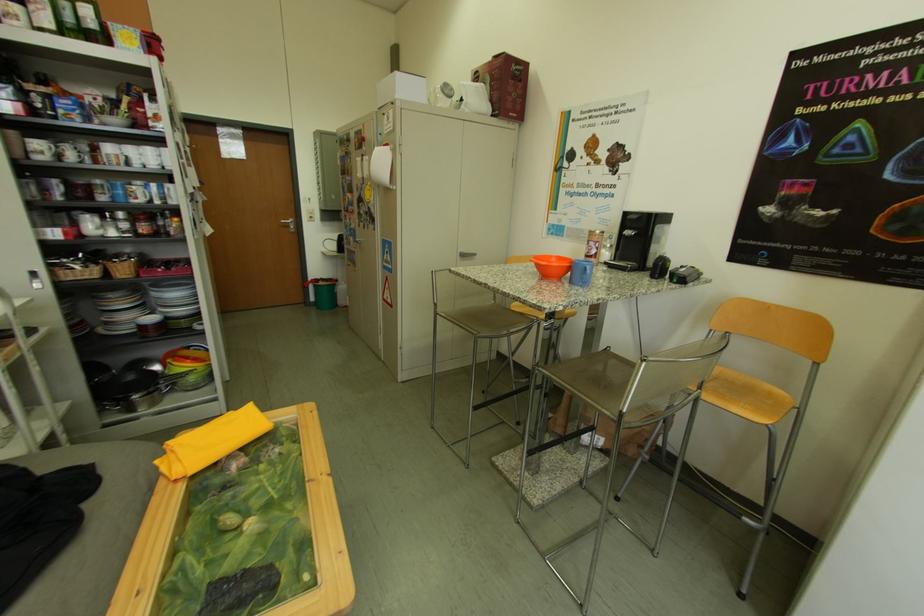
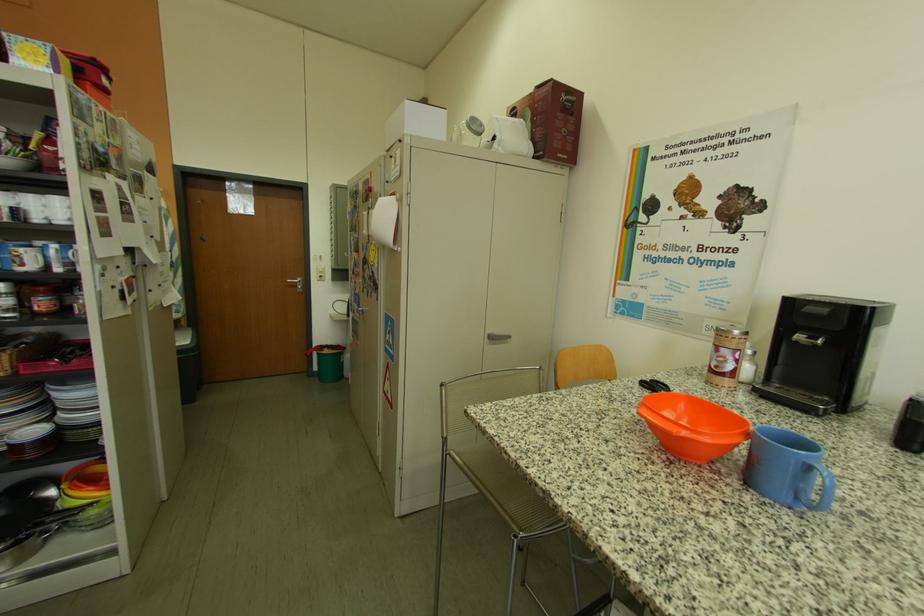
Locate, in the second image, the point that corresponds to point 521,118 in the first image.

(570, 158)